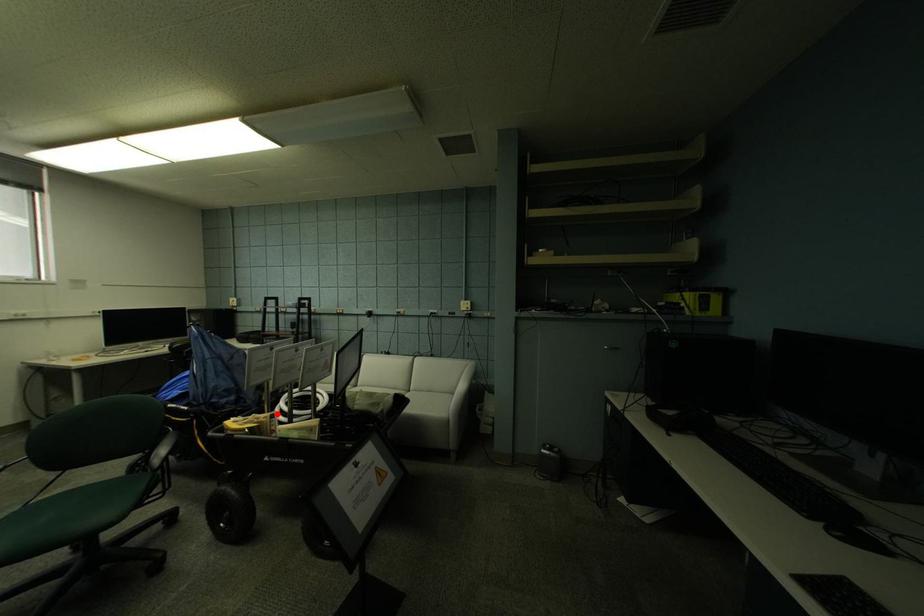
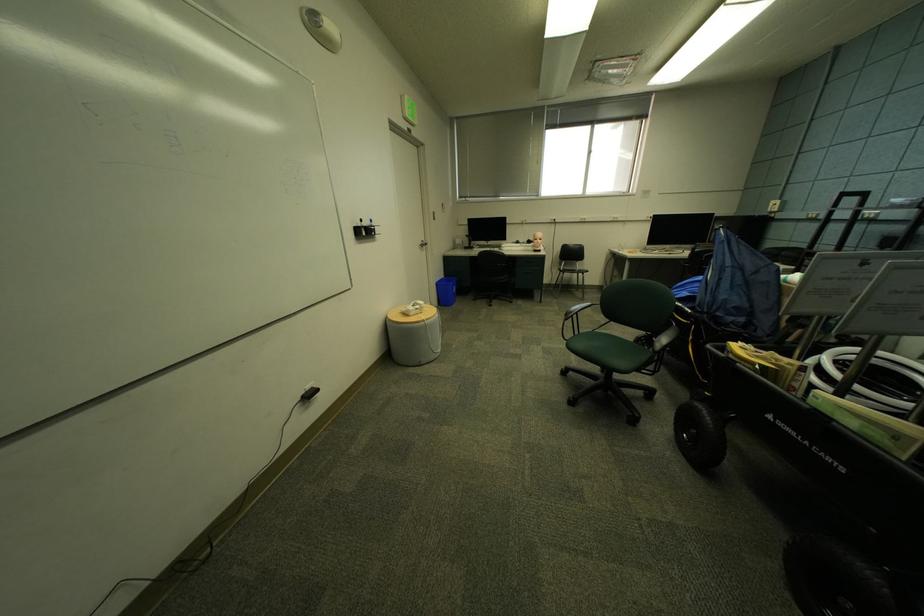
Locate, in the second image, the point that corresponds to the highlighted location in the first image.

(807, 362)